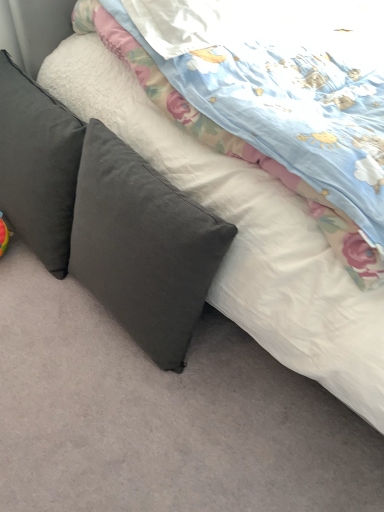
Question: Is dark gray fabric pillow at left, marked as the 2th pillow in a right-to-left arrangement, not within dark gray fabric pillow at left, the 2th pillow viewed from the left?

Choices:
 (A) no
 (B) yes

Answer: (B)

Question: From a real-world perspective, is dark gray fabric pillow at left, marked as the 2th pillow in a right-to-left arrangement, physically above dark gray fabric pillow at left, the 2th pillow viewed from the left?

Choices:
 (A) no
 (B) yes

Answer: (B)

Question: Is dark gray fabric pillow at left, marked as the 1th pillow in a left-to-right arrangement, touching dark gray fabric pillow at left, which ranks as the 1th pillow in right-to-left order?

Choices:
 (A) no
 (B) yes

Answer: (A)

Question: Does dark gray fabric pillow at left, marked as the 1th pillow in a left-to-right arrangement, appear on the left side of dark gray fabric pillow at left, the 2th pillow viewed from the left?

Choices:
 (A) yes
 (B) no

Answer: (A)

Question: From a real-world perspective, is dark gray fabric pillow at left, marked as the 1th pillow in a left-to-right arrangement, beneath dark gray fabric pillow at left, the 2th pillow viewed from the left?

Choices:
 (A) no
 (B) yes

Answer: (A)

Question: Does dark gray fabric pillow at left, marked as the 1th pillow in a left-to-right arrangement, have a greater width compared to dark gray fabric pillow at left, the 2th pillow viewed from the left?

Choices:
 (A) yes
 (B) no

Answer: (A)

Question: From a real-world perspective, is dark gray fabric pillow at left, the 2th pillow viewed from the left, beneath dark gray fabric pillow at left, marked as the 2th pillow in a right-to-left arrangement?

Choices:
 (A) no
 (B) yes

Answer: (B)

Question: Is dark gray fabric pillow at left, the 2th pillow viewed from the left, positioned with its back to dark gray fabric pillow at left, marked as the 2th pillow in a right-to-left arrangement?

Choices:
 (A) yes
 (B) no

Answer: (B)

Question: Is dark gray fabric pillow at left, which ranks as the 1th pillow in right-to-left order, shorter than dark gray fabric pillow at left, marked as the 2th pillow in a right-to-left arrangement?

Choices:
 (A) yes
 (B) no

Answer: (B)

Question: Does dark gray fabric pillow at left, the 2th pillow viewed from the left, appear on the right side of dark gray fabric pillow at left, marked as the 1th pillow in a left-to-right arrangement?

Choices:
 (A) no
 (B) yes

Answer: (B)

Question: Is dark gray fabric pillow at left, which ranks as the 1th pillow in right-to-left order, aimed at dark gray fabric pillow at left, marked as the 1th pillow in a left-to-right arrangement?

Choices:
 (A) yes
 (B) no

Answer: (B)

Question: From a real-world perspective, is dark gray fabric pillow at left, which ranks as the 1th pillow in right-to-left order, over dark gray fabric pillow at left, marked as the 2th pillow in a right-to-left arrangement?

Choices:
 (A) no
 (B) yes

Answer: (A)

Question: Is point coord(44,184) closer or farther from the camera than point coord(160,347)?

Choices:
 (A) farther
 (B) closer

Answer: (A)